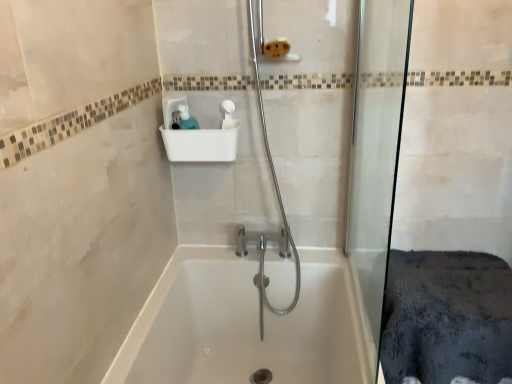
Question: From a real-world perspective, is transparent glass shower door at right physically located above or below white plastic sink at upper center?

Choices:
 (A) below
 (B) above

Answer: (A)

Question: In terms of size, does transparent glass shower door at right appear bigger or smaller than white plastic sink at upper center?

Choices:
 (A) small
 (B) big

Answer: (B)

Question: Which object is the closest to the white glossy bathtub at center?

Choices:
 (A) white plastic sink at upper center
 (B) transparent glass shower door at right

Answer: (B)

Question: Which object is the closest to the white plastic sink at upper center?

Choices:
 (A) white glossy bathtub at center
 (B) transparent glass shower door at right

Answer: (B)